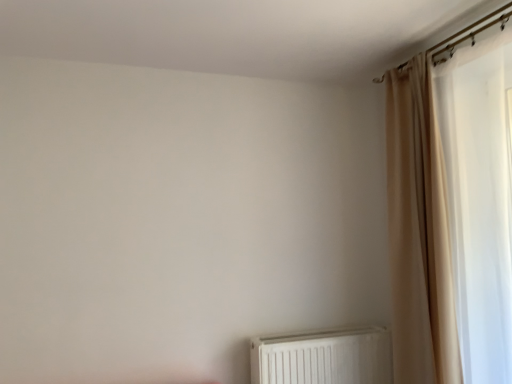
Question: From a real-world perspective, is beige fabric curtain at right physically below white plastic radiator at lower center?

Choices:
 (A) no
 (B) yes

Answer: (A)

Question: Is white plastic radiator at lower center completely or partially inside beige fabric curtain at right?

Choices:
 (A) yes
 (B) no

Answer: (B)

Question: Does beige fabric curtain at right have a smaller size compared to white plastic radiator at lower center?

Choices:
 (A) yes
 (B) no

Answer: (B)

Question: Is beige fabric curtain at right shorter than white plastic radiator at lower center?

Choices:
 (A) yes
 (B) no

Answer: (B)

Question: Can you confirm if beige fabric curtain at right is wider than white plastic radiator at lower center?

Choices:
 (A) no
 (B) yes

Answer: (B)

Question: Is beige fabric curtain at right positioned beyond the bounds of white plastic radiator at lower center?

Choices:
 (A) no
 (B) yes

Answer: (B)

Question: Does white plastic radiator at lower center lie in front of beige fabric curtain at right?

Choices:
 (A) no
 (B) yes

Answer: (A)

Question: Is white plastic radiator at lower center beside beige fabric curtain at right?

Choices:
 (A) no
 (B) yes

Answer: (A)

Question: Is white plastic radiator at lower center not within beige fabric curtain at right?

Choices:
 (A) no
 (B) yes

Answer: (B)

Question: From a real-world perspective, is white plastic radiator at lower center on beige fabric curtain at right?

Choices:
 (A) yes
 (B) no

Answer: (B)

Question: Is beige fabric curtain at right completely or partially inside white plastic radiator at lower center?

Choices:
 (A) no
 (B) yes

Answer: (A)

Question: Is white plastic radiator at lower center to the right of beige fabric curtain at right from the viewer's perspective?

Choices:
 (A) no
 (B) yes

Answer: (A)

Question: Which is correct: white plastic radiator at lower center is inside beige fabric curtain at right, or outside of it?

Choices:
 (A) outside
 (B) inside

Answer: (A)